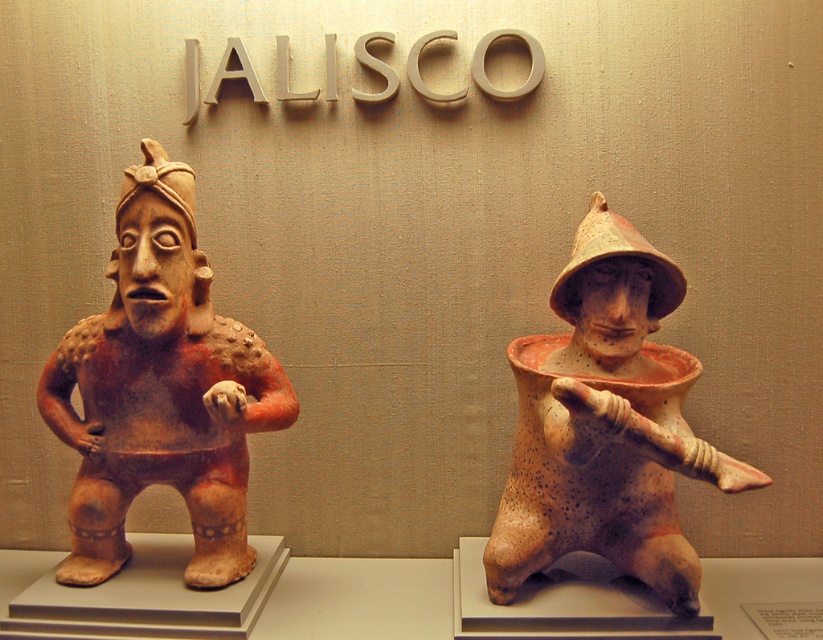
Is matte orange clay figure at left shorter than speckled clay figure at center?

No.

Can you confirm if matte orange clay figure at left is bigger than speckled clay figure at center?

Correct, matte orange clay figure at left is larger in size than speckled clay figure at center.

At what (x,y) coordinates should I click in order to perform the action: click on matte orange clay figure at left. Please return your answer as a coordinate pair (x, y). Looking at the image, I should click on (161, 388).

This screenshot has height=640, width=823. What are the coordinates of `matte orange clay figure at left` in the screenshot? It's located at (161, 388).